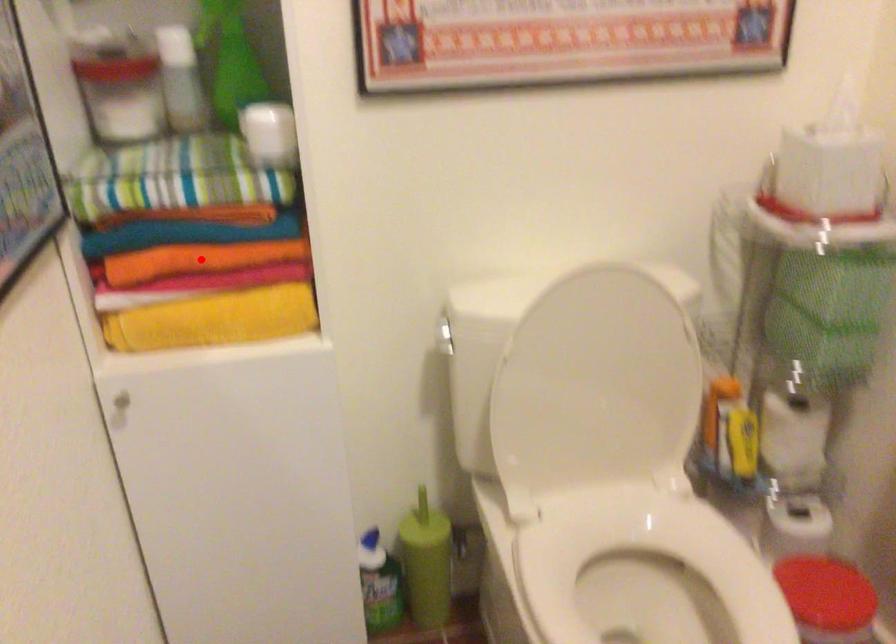
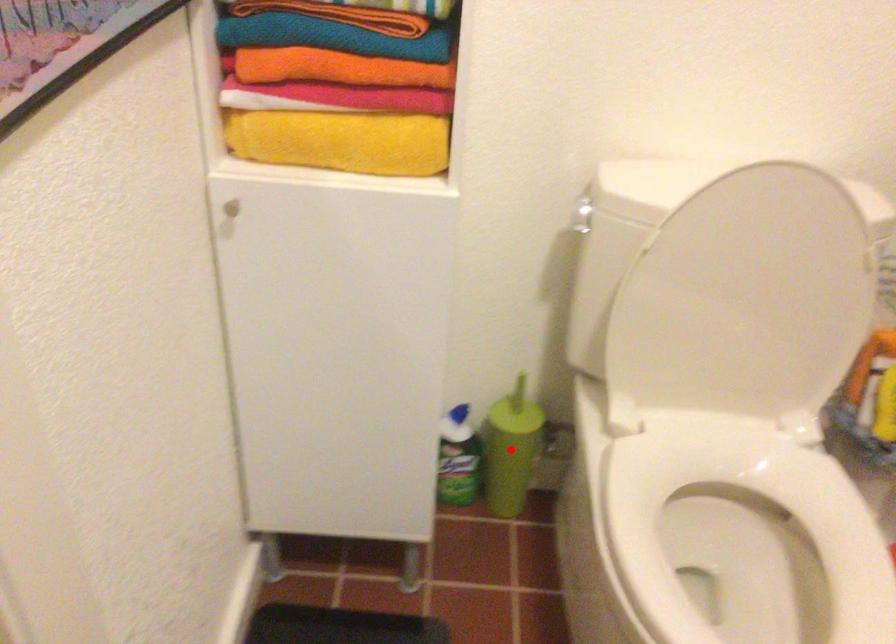
I am providing you with two images of the same scene from different viewpoints. A red point is marked on the first image and another point is marked on the second image. Do the highlighted points in image1 and image2 indicate the same real-world spot?

No